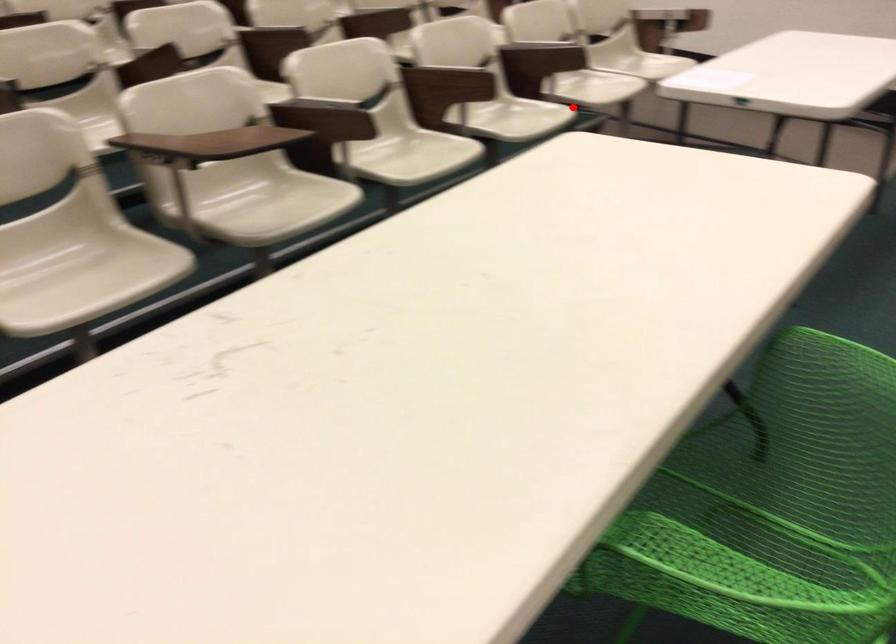
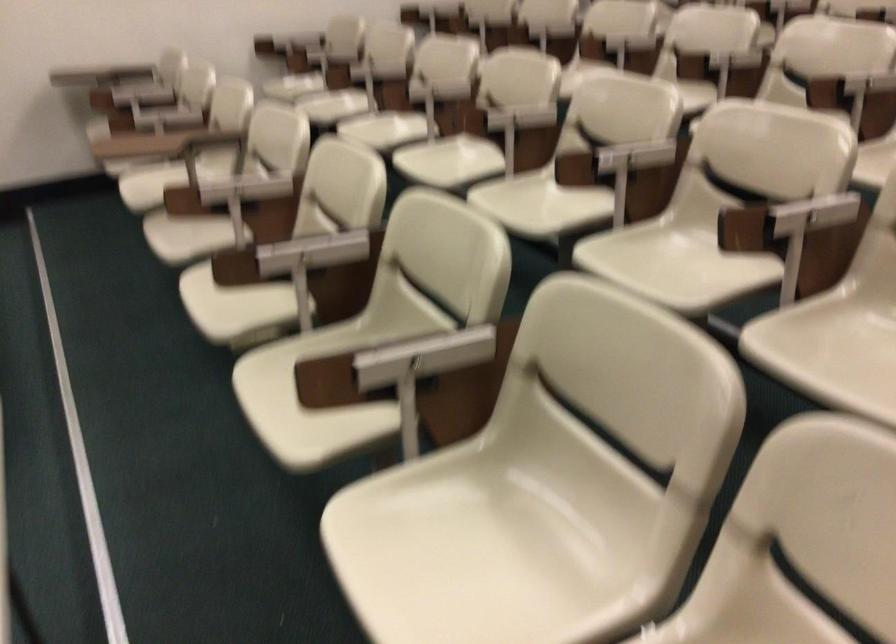
Where in the second image is the point corresponding to the highlighted location from the first image?

(455, 540)